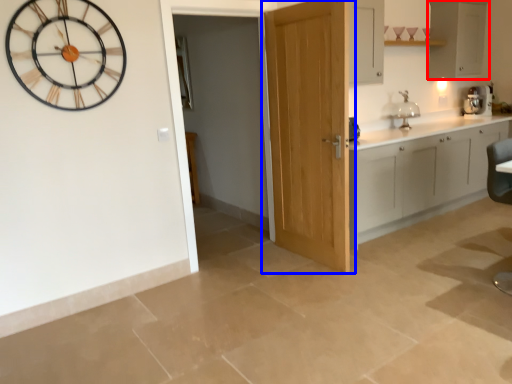
Question: Which object is further to the camera taking this photo, cabinetry (highlighted by a red box) or door (highlighted by a blue box)?

Choices:
 (A) cabinetry
 (B) door

Answer: (A)